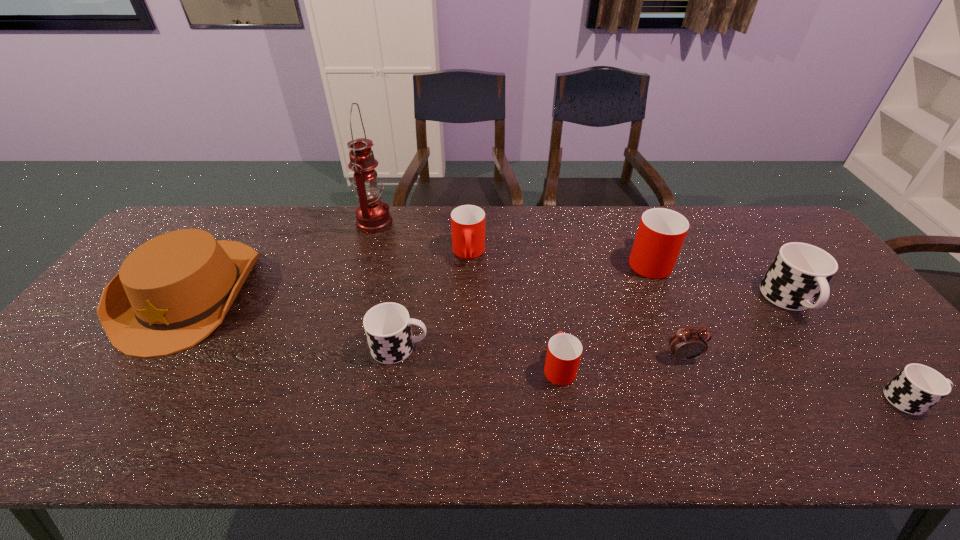
This screenshot has width=960, height=540. I want to click on cup that can be found as the fifth closest to the fourth cup from left to right, so click(387, 325).

Identify which red cup is the closest to the smallest black cup. Please provide its 2D coordinates. Your answer should be formatted as a tuple, i.e. [(x, y)], where the tuple contains the x and y coordinates of a point satisfying the conditions above.

[(661, 232)]

Where is `red cup that is the closest to the leftmost red cup`? Image resolution: width=960 pixels, height=540 pixels. red cup that is the closest to the leftmost red cup is located at coordinates click(x=564, y=351).

Where is `black cup object that ranks as the second closest to the biggest black cup`? black cup object that ranks as the second closest to the biggest black cup is located at coordinates (387, 325).

Where is `the closest black cup to the leftmost object`? The image size is (960, 540). the closest black cup to the leftmost object is located at coordinates (387, 325).